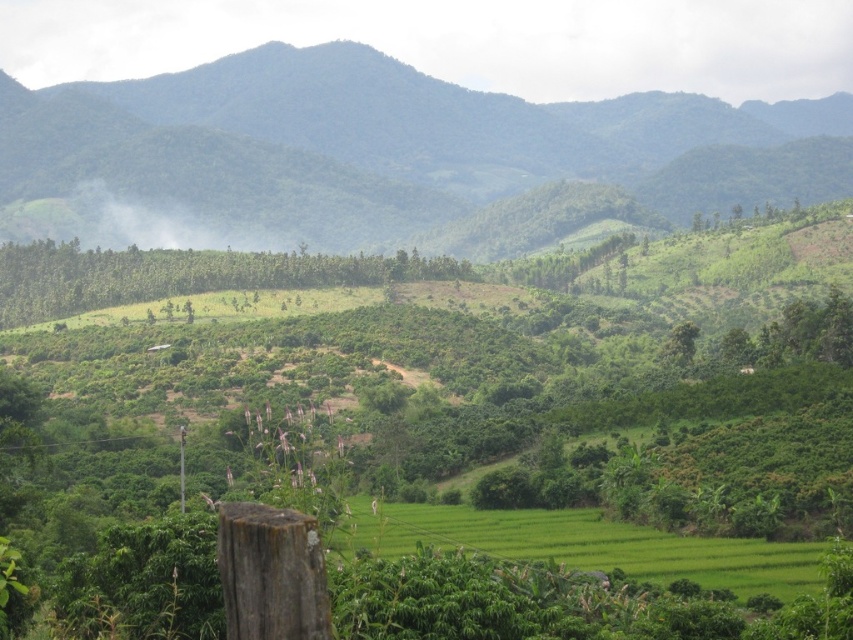
Question: Among these objects, which one is farthest from the camera?

Choices:
 (A) green grassy field at center
 (B) green leafy mountain at center

Answer: (B)

Question: Does green leafy mountain at center appear over green grassy field at center?

Choices:
 (A) no
 (B) yes

Answer: (B)

Question: Does green leafy mountain at center have a greater width compared to green grassy field at center?

Choices:
 (A) no
 (B) yes

Answer: (B)

Question: Among these points, which one is farthest from the camera?

Choices:
 (A) (172, 115)
 (B) (758, 547)

Answer: (A)

Question: Does green leafy mountain at center lie in front of green grassy field at center?

Choices:
 (A) no
 (B) yes

Answer: (A)

Question: Which of the following is the farthest from the observer?

Choices:
 (A) green leafy mountain at center
 (B) green grassy field at center

Answer: (A)